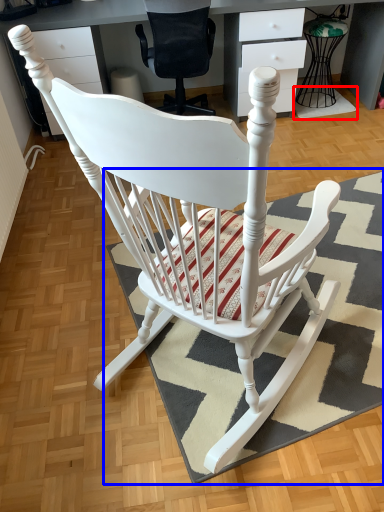
Question: Which of the following is the closest to the observer, doormat (highlighted by a red box) or doormat (highlighted by a blue box)?

Choices:
 (A) doormat
 (B) doormat

Answer: (B)